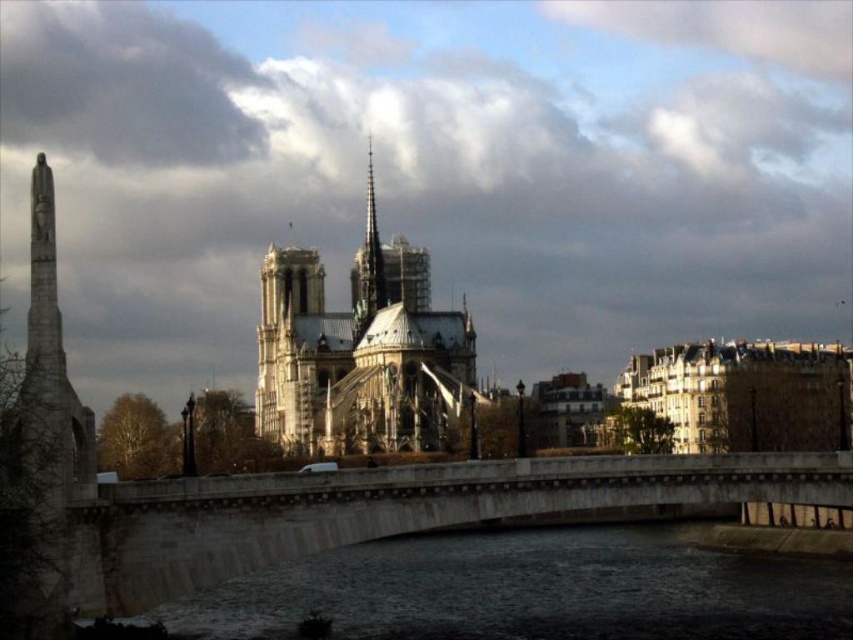
Which is above, concrete bridge at center or stone spire at center?

stone spire at center is higher up.

Is point (171, 579) closer to camera compared to point (422, 298)?

Yes, point (171, 579) is closer to viewer.

I want to click on concrete bridge at center, so click(x=393, y=509).

Who is positioned more to the left, stone spire at center or smooth stone spire at center?

Positioned to the left is stone spire at center.

Is stone spire at center in front of smooth stone spire at center?

Yes, stone spire at center is closer to the viewer.

Between point (299, 346) and point (367, 240), which one is positioned in front?

Point (299, 346) is in front.

You are a GUI agent. You are given a task and a screenshot of the screen. Output one action in this format:
    pyautogui.click(x=<x>, y=<y>)
    Task: Click on the stone spire at center
    
    Given the screenshot: What is the action you would take?
    pyautogui.click(x=358, y=353)

Does concrete bridge at center have a greater width compared to smooth stone spire at center?

Indeed, concrete bridge at center has a greater width compared to smooth stone spire at center.

Who is lower down, concrete bridge at center or smooth stone spire at center?

Positioned lower is concrete bridge at center.

At what (x,y) coordinates should I click in order to perform the action: click on concrete bridge at center. Please return your answer as a coordinate pair (x, y). The width and height of the screenshot is (853, 640). Looking at the image, I should click on (393, 509).

Where is `concrete bridge at center`? The image size is (853, 640). concrete bridge at center is located at coordinates (393, 509).